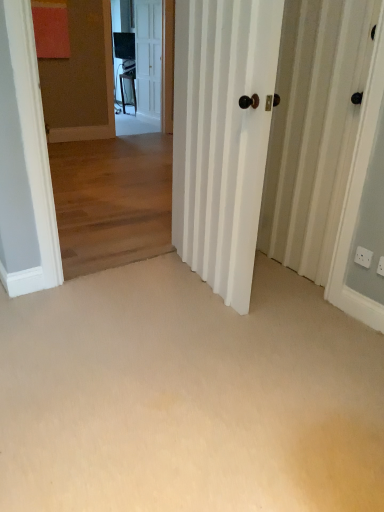
The image size is (384, 512). In order to click on free region under wooden floor at center, the 1th corridor when ordered from top to bottom (from a real-world perspective) in this screenshot , I will do `click(128, 265)`.